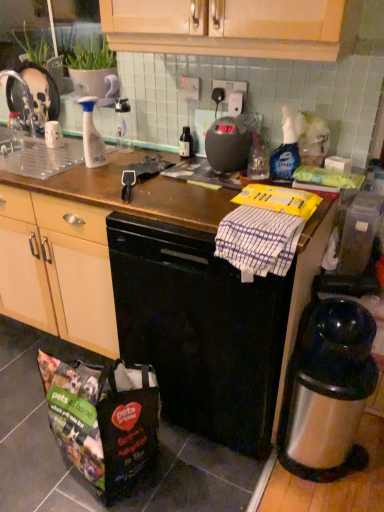
The height and width of the screenshot is (512, 384). What do you see at coordinates (123, 125) in the screenshot? I see `clear plastic bottle at center, the 2th bottle in the left-to-right sequence` at bounding box center [123, 125].

Describe the element at coordinates (230, 142) in the screenshot. I see `black plastic scale at center` at that location.

Locate an element on the screen. Image resolution: width=384 pixels, height=512 pixels. clear plastic bottle at center, the 2th bottle in the left-to-right sequence is located at coordinates [x=123, y=125].

Is point (27, 90) closer to camera compared to point (155, 245)?

No, (27, 90) is further to viewer.

Which of these two, matte black faucet at left or brown wooden counter top at center, is bigger?

brown wooden counter top at center is bigger.

From a real-world perspective, is matte black faucet at left positioned over brown wooden counter top at center based on gravity?

Correct, in the physical world, matte black faucet at left is higher than brown wooden counter top at center.

Does matte black faucet at left have a greater height compared to brown wooden counter top at center?

No.

From a real-world perspective, does brown wooden counter top at center stand above clear plastic bottle at center, the 2th bottle in the left-to-right sequence?

Incorrect, from a real-world perspective, brown wooden counter top at center is lower than clear plastic bottle at center, the 2th bottle in the left-to-right sequence.

Are brown wooden counter top at center and clear plastic bottle at center, the 3th bottle viewed from the right, far apart?

No, brown wooden counter top at center is not far from clear plastic bottle at center, the 3th bottle viewed from the right.

From the image's perspective, which is above, brown wooden counter top at center or clear plastic bottle at center, the 2th bottle in the left-to-right sequence?

clear plastic bottle at center, the 2th bottle in the left-to-right sequence, from the image's perspective.

Would you say matte black faucet at left is inside or outside black glass bottle at center, the second bottle from the right?

matte black faucet at left is outside black glass bottle at center, the second bottle from the right.

From a real-world perspective, who is located lower, matte black faucet at left or black glass bottle at center, which is the 3th bottle in left-to-right order?

In real-world perspective, black glass bottle at center, which is the 3th bottle in left-to-right order, is lower.

From the image's perspective, relative to black glass bottle at center, which is the 3th bottle in left-to-right order, is matte black faucet at left above or below?

matte black faucet at left is above black glass bottle at center, which is the 3th bottle in left-to-right order.

Considering the sizes of matte black faucet at left and black glass bottle at center, the second bottle from the right, in the image, is matte black faucet at left wider or thinner than black glass bottle at center, the second bottle from the right,?

matte black faucet at left is wider than black glass bottle at center, the second bottle from the right.

Does transparent plastic container at right appear on the right side of white striped towel at center?

Yes.

Is transparent plastic container at right further to camera compared to white striped towel at center?

Yes, transparent plastic container at right is further from the camera.

From a real-world perspective, between transparent plastic container at right and white striped towel at center, who is vertically lower?

transparent plastic container at right, from a real-world perspective.

Is transparent plastic container at right bigger than white striped towel at center?

Yes.

Looking at the image, does polyester shopping bag at lower left seem bigger or smaller compared to black plastic scale at center?

Clearly, polyester shopping bag at lower left is larger in size than black plastic scale at center.

Can you confirm if polyester shopping bag at lower left is positioned to the right of black plastic scale at center?

No, polyester shopping bag at lower left is not to the right of black plastic scale at center.

Is the position of polyester shopping bag at lower left less distant than that of black plastic scale at center?

Yes.

From the image's perspective, who appears lower, polyester shopping bag at lower left or black plastic scale at center?

polyester shopping bag at lower left is shown below in the image.

Is white striped towel at center oriented towards translucent plastic spray bottle at center-left, marked as the 1th bottle in a left-to-right arrangement?

No, white striped towel at center does not turn towards translucent plastic spray bottle at center-left, marked as the 1th bottle in a left-to-right arrangement.

Considering the relative sizes of white striped towel at center and translucent plastic spray bottle at center-left, which is counted as the 4th bottle, starting from the right, in the image provided, is white striped towel at center smaller than translucent plastic spray bottle at center-left, which is counted as the 4th bottle, starting from the right,?

Incorrect, white striped towel at center is not smaller in size than translucent plastic spray bottle at center-left, which is counted as the 4th bottle, starting from the right.

Which of these two, white striped towel at center or translucent plastic spray bottle at center-left, marked as the 1th bottle in a left-to-right arrangement, stands shorter?

white striped towel at center is shorter.

Is white striped towel at center positioned beyond the bounds of glossy plastic spray bottle at upper right, the 1th bottle in the right-to-left sequence?

Yes, white striped towel at center is outside of glossy plastic spray bottle at upper right, the 1th bottle in the right-to-left sequence.

How different are the orientations of white striped towel at center and glossy plastic spray bottle at upper right, acting as the 4th bottle starting from the left, in degrees?

They differ by 0.00198 degrees in their facing directions.

From the image's perspective, is white striped towel at center beneath glossy plastic spray bottle at upper right, the 1th bottle in the right-to-left sequence?

Indeed, from the image's perspective, white striped towel at center is shown beneath glossy plastic spray bottle at upper right, the 1th bottle in the right-to-left sequence.

Is white striped towel at center positioned with its back to glossy plastic spray bottle at upper right, acting as the 4th bottle starting from the left?

white striped towel at center is not turned away from glossy plastic spray bottle at upper right, acting as the 4th bottle starting from the left.

Locate an element on the screen. faucet behind the brown wooden counter top at center is located at coordinates (25, 93).

Locate an element on the screen. The width and height of the screenshot is (384, 512). bottle that is the 4th one when counting upward from the brown wooden counter top at center (from the image's perspective) is located at coordinates (123, 125).

Based on their spatial positions, is white striped towel at center or translucent plastic spray bottle at center-left, marked as the 1th bottle in a left-to-right arrangement, closer to polyester shopping bag at lower left?

Among the two, white striped towel at center is located nearer to polyester shopping bag at lower left.

Considering their positions, is black plastic scale at center positioned further to clear plastic bottle at center, the 2th bottle in the left-to-right sequence, than translucent plastic spray bottle at center-left, which is counted as the 4th bottle, starting from the right?

black plastic scale at center is further to clear plastic bottle at center, the 2th bottle in the left-to-right sequence.

Considering their positions, is black glass bottle at center, the second bottle from the right, positioned further to black matte dishwasher at center than white striped towel at center?

black glass bottle at center, the second bottle from the right, is positioned further to the anchor black matte dishwasher at center.

Which object lies nearer to the anchor point translucent plastic spray bottle at center-left, which is counted as the 4th bottle, starting from the right, transparent plastic container at right or matte black faucet at left?

matte black faucet at left is positioned closer to the anchor translucent plastic spray bottle at center-left, which is counted as the 4th bottle, starting from the right.

Based on their spatial positions, is black glass bottle at center, which is the 3th bottle in left-to-right order, or transparent plastic container at right further from black plastic scale at center?

Among the two, transparent plastic container at right is located further to black plastic scale at center.

Estimate the real-world distances between objects in this image. Which object is further from black matte dishwasher at center, brown wooden counter top at center or black glass bottle at center, which is the 3th bottle in left-to-right order?

Among the two, black glass bottle at center, which is the 3th bottle in left-to-right order, is located further to black matte dishwasher at center.

Which object lies nearer to the anchor point black glass bottle at center, which is the 3th bottle in left-to-right order, matte black faucet at left or black matte dishwasher at center?

black matte dishwasher at center is closer to black glass bottle at center, which is the 3th bottle in left-to-right order.

From the image, which object appears to be nearer to transparent plastic container at right, black plastic scale at center or white striped towel at center?

Among the two, white striped towel at center is located nearer to transparent plastic container at right.

At what (x,y) coordinates should I click in order to perform the action: click on counter top between matte black faucet at left and black matte dishwasher at center in the horizontal direction. Please return your answer as a coordinate pair (x, y). This screenshot has height=512, width=384. Looking at the image, I should click on (174, 305).

At what (x,y) coordinates should I click in order to perform the action: click on counter top situated between matte black faucet at left and white striped towel at center from left to right. Please return your answer as a coordinate pair (x, y). The image size is (384, 512). Looking at the image, I should click on (174, 305).

Where is `counter top between matte black faucet at left and glossy plastic spray bottle at upper right, the 1th bottle in the right-to-left sequence, in the horizontal direction`? Image resolution: width=384 pixels, height=512 pixels. counter top between matte black faucet at left and glossy plastic spray bottle at upper right, the 1th bottle in the right-to-left sequence, in the horizontal direction is located at coordinates (174, 305).

Find the location of a particular element. The image size is (384, 512). home appliance between white striped towel at center and clear plastic bottle at center, the 3th bottle viewed from the right, in the front-back direction is located at coordinates (230, 142).